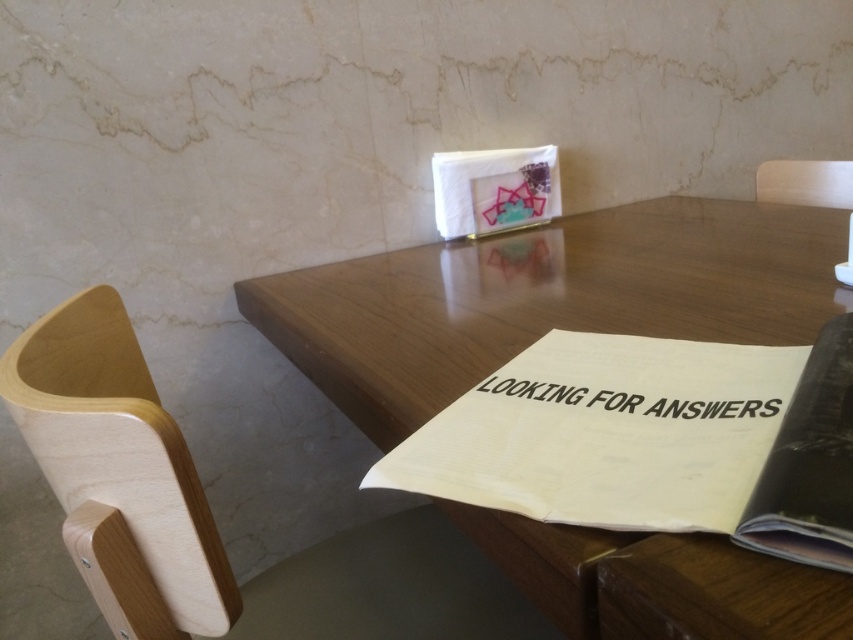
You are sitting in the light wood chair at lower left and want to pick up the white paper book at center. Can you reach it without moving from your seat?

The white paper book at center is above the light wood chair at lower left, so you can reach it from the light wood chair at lower left as it is within arm

Based on the photo, you are sitting at the wooden table in the image and want to reach for an object. There are two points marked on the table surface, one at coordinates point (637, 451) and another at point (405, 616). Which point would you need to reach forward more to touch?

Point (637, 451) is in front of point (405, 616), so you would need to reach forward more to touch point (637, 451) because it is closer to you.